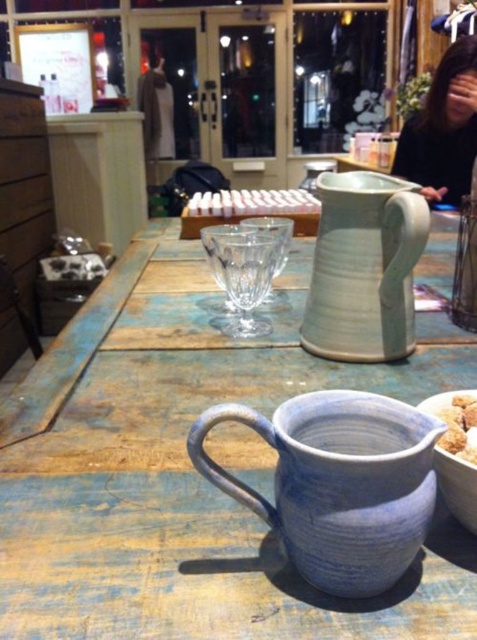
Does dark brown hair at upper right appear on the left side of matte white bowl at lower right?

No, dark brown hair at upper right is not to the left of matte white bowl at lower right.

Is dark brown hair at upper right in front of matte white bowl at lower right?

No, dark brown hair at upper right is behind matte white bowl at lower right.

Which is in front, point (453, 173) or point (435, 458)?

Point (435, 458)

This screenshot has height=640, width=477. Find the location of `dark brown hair at upper right`. dark brown hair at upper right is located at coordinates (443, 129).

Can you confirm if blue textured pitcher at center is positioned to the left of matte ceramic pitcher at center?

Indeed, blue textured pitcher at center is positioned on the left side of matte ceramic pitcher at center.

Which is more to the left, blue textured pitcher at center or matte ceramic pitcher at center?

From the viewer's perspective, blue textured pitcher at center appears more on the left side.

This screenshot has height=640, width=477. Describe the element at coordinates (190, 472) in the screenshot. I see `blue textured pitcher at center` at that location.

Identify the location of blue textured pitcher at center. The width and height of the screenshot is (477, 640). (190, 472).

Between dark brown hair at upper right and brown crumbly at center, which one has more height?

dark brown hair at upper right

Between dark brown hair at upper right and brown crumbly at center, which one appears on the left side from the viewer's perspective?

brown crumbly at center is more to the left.

Does point (414, 125) come behind point (453, 420)?

Yes, it is.

I want to click on dark brown hair at upper right, so point(443,129).